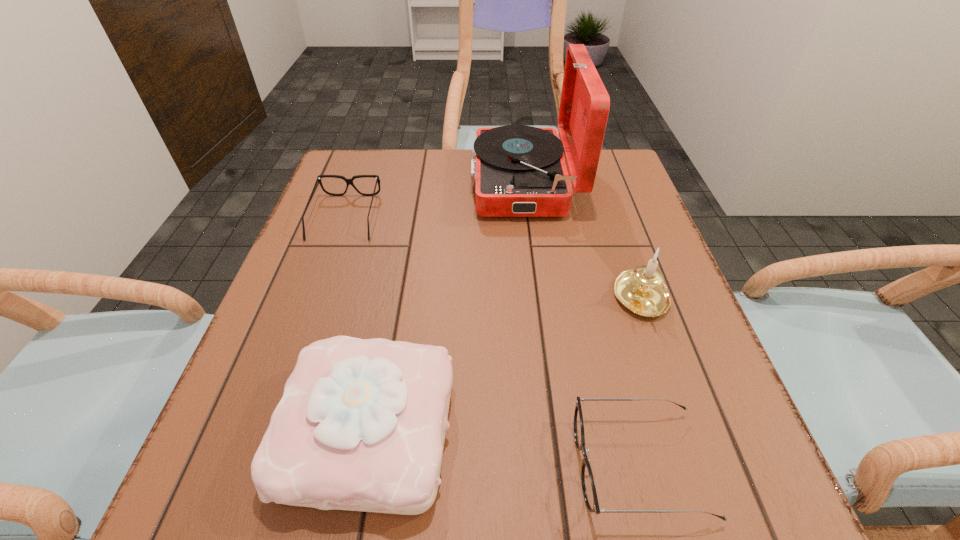
At what (x,y) coordinates should I click in order to perform the action: click on phonograph_record. Please return your answer as a coordinate pair (x, y). The image size is (960, 540). Looking at the image, I should click on (519, 171).

Find the location of a particular element. This screenshot has width=960, height=540. candle holder is located at coordinates (641, 290).

I want to click on the third shortest object, so click(361, 425).

What are the coordinates of `the left spectacles` in the screenshot? It's located at (348, 181).

Where is `the nearer spectacles`? This screenshot has height=540, width=960. the nearer spectacles is located at coordinates (588, 486).

Locate an element on the screen. The image size is (960, 540). free spot located on the front-facing side of the phonograph_record is located at coordinates [331, 182].

You are a GUI agent. You are given a task and a screenshot of the screen. Output one action in this format:
    pyautogui.click(x=<x>, y=<y>)
    Task: Click on the blank space located on the front-facing side of the phonograph_record
    
    Given the screenshot: What is the action you would take?
    pyautogui.click(x=394, y=182)

Find the location of a particular element. The width and height of the screenshot is (960, 540). vacant region located on the front-facing side of the phonograph_record is located at coordinates (417, 182).

Image resolution: width=960 pixels, height=540 pixels. What are the coordinates of `free space located 0.300m on the handle side of the candle holder` in the screenshot? It's located at (715, 509).

Locate an element on the screen. free space located 0.320m on the right of the cake is located at coordinates (666, 429).